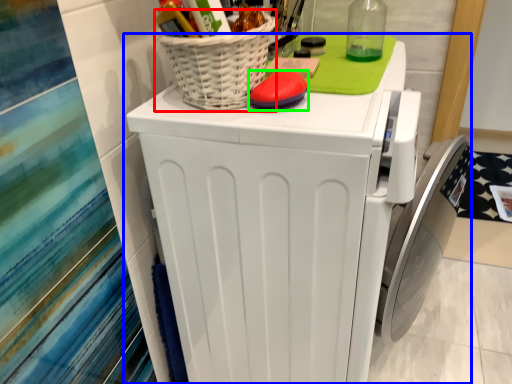
Question: Estimate the real-world distances between objects in this image. Which object is farther from basket (highlighted by a red box), home appliance (highlighted by a blue box) or soap (highlighted by a green box)?

Choices:
 (A) home appliance
 (B) soap

Answer: (A)